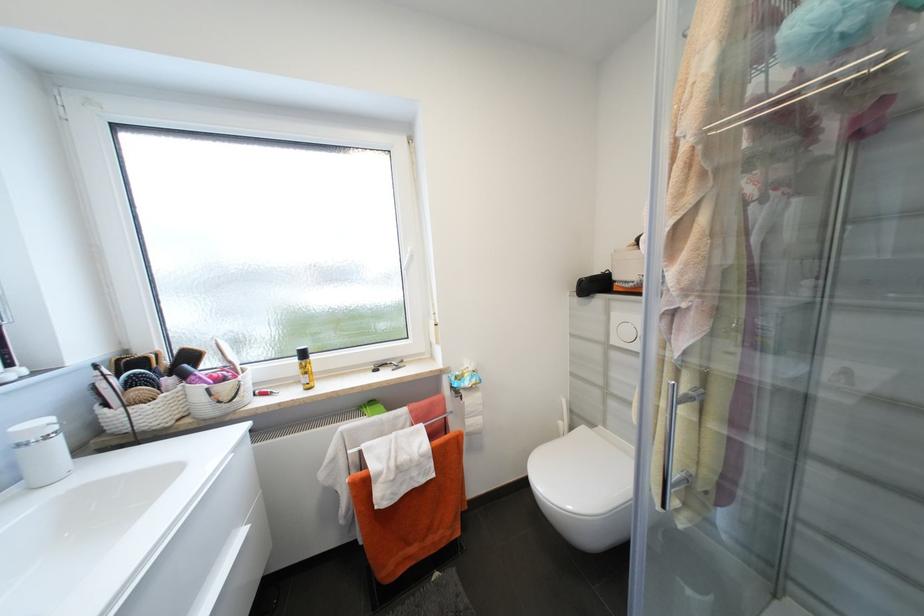
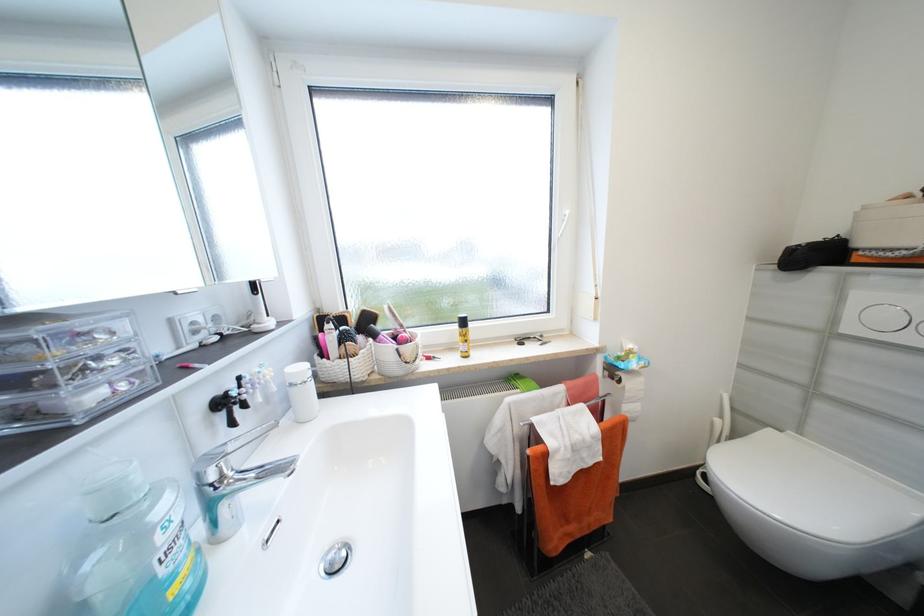
Question: How did the camera likely rotate?

Choices:
 (A) Left
 (B) Right
 (C) Up
 (D) Down

Answer: (A)